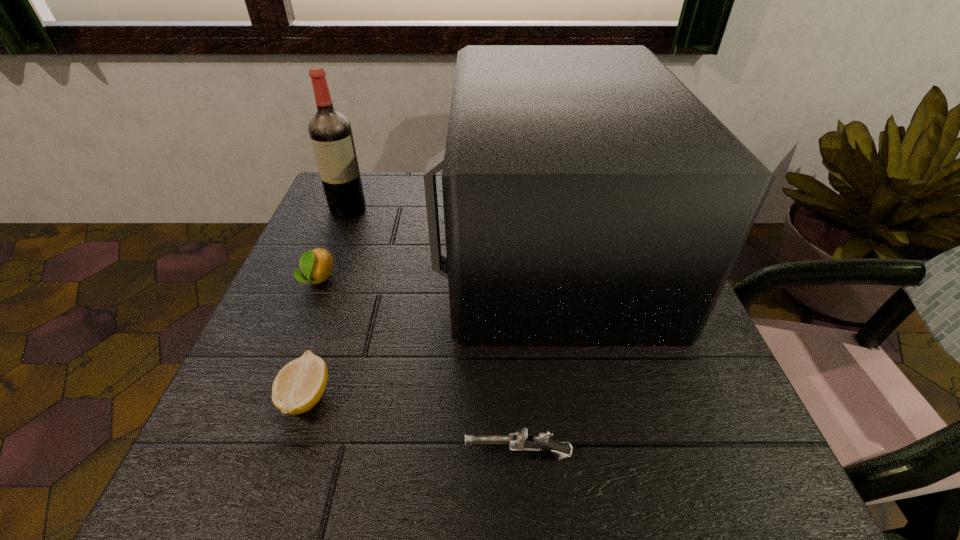
This screenshot has width=960, height=540. In order to click on unoccupied position between the fourth farthest object and the microwave oven in this screenshot , I will do `click(427, 320)`.

Identify the location of free area in between the shorter lemon and the microwave oven. This screenshot has height=540, width=960. (427, 320).

I want to click on free spot between the shortest object and the taller lemon, so click(x=312, y=338).

You are a GUI agent. You are given a task and a screenshot of the screen. Output one action in this format:
    pyautogui.click(x=<x>, y=<y>)
    Task: Click on the object that is the second nearest to the liquor
    This screenshot has height=540, width=960.
    Given the screenshot: What is the action you would take?
    pyautogui.click(x=590, y=198)

Identify which object is located as the third nearest to the nearest object. Please provide its 2D coordinates. Your answer should be formatted as a tuple, i.e. [(x, y)], where the tuple contains the x and y coordinates of a point satisfying the conditions above.

[(316, 265)]

Identify the location of free space that satisfies the following two spatial constraints: 1. on the front-facing side of the liquor; 2. on the left side of the fourth farthest object. The width and height of the screenshot is (960, 540). (274, 396).

At what (x,y) coordinates should I click in order to perform the action: click on vacant region that satisfies the following two spatial constraints: 1. with leaves positioned above the second nearest object; 2. on the left side of the farther lemon. Please return your answer as a coordinate pair (x, y). The width and height of the screenshot is (960, 540). Looking at the image, I should click on (271, 396).

At what (x,y) coordinates should I click in order to perform the action: click on free space that satisfies the following two spatial constraints: 1. on the front-facing side of the microwave oven; 2. with leaves positioned above the farther lemon. Please return your answer as a coordinate pair (x, y). Looking at the image, I should click on (555, 279).